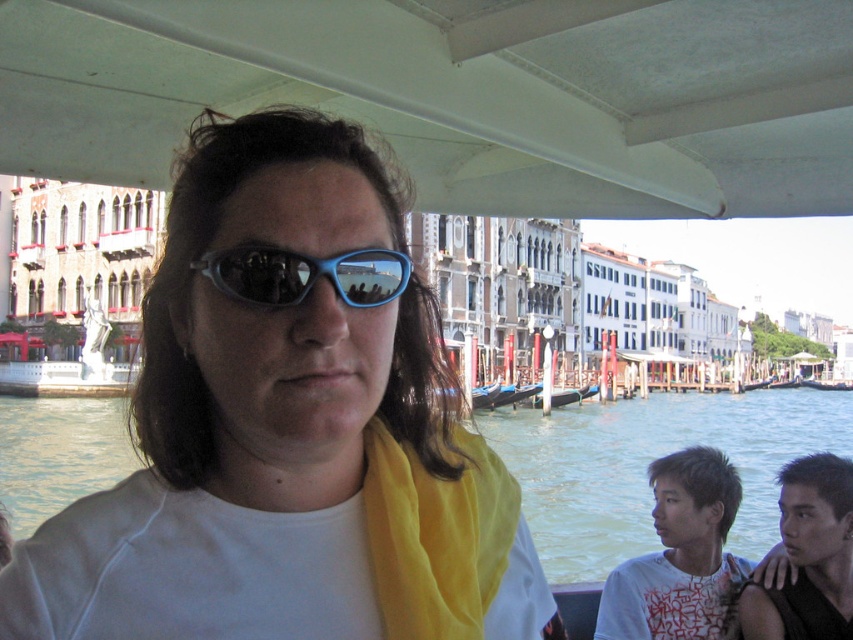
Question: Does white matte sunglasses at center have a greater width compared to clear water at center?

Choices:
 (A) no
 (B) yes

Answer: (A)

Question: Is clear water at center wider than blue plastic goggles at center?

Choices:
 (A) yes
 (B) no

Answer: (A)

Question: Which point appears closest to the camera in this image?

Choices:
 (A) (184, 496)
 (B) (376, 304)
 (C) (569, 573)

Answer: (A)

Question: Which of these objects is positioned closest to the white matte sunglasses at center?

Choices:
 (A) blue plastic goggles at center
 (B) smooth black hair at lower right

Answer: (A)

Question: Is white matte shirt at lower right in front of blue plastic goggles at center?

Choices:
 (A) yes
 (B) no

Answer: (B)

Question: Estimate the real-world distances between objects in this image. Which object is closer to the blue plastic goggles at center?

Choices:
 (A) clear water at center
 (B) white matte sunglasses at center
 (C) white matte shirt at lower right
 (D) smooth black hair at lower right

Answer: (B)